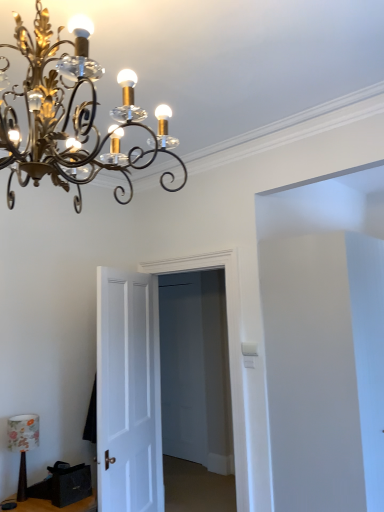
This screenshot has width=384, height=512. Describe the element at coordinates (128, 393) in the screenshot. I see `white matte door at center, positioned as the 1th door in left-to-right order` at that location.

How much space does white wooden door at center, which appears as the 1th door when viewed from the right, occupy vertically?

white wooden door at center, which appears as the 1th door when viewed from the right, is 2.24 meters in height.

The width and height of the screenshot is (384, 512). Describe the element at coordinates (23, 444) in the screenshot. I see `floral fabric lampshade at lower left, the 2th lamp positioned from the top` at that location.

Locate an element on the screen. white matte door at center, positioned as the 1th door in left-to-right order is located at coordinates (128, 393).

Between floral fabric lampshade at lower left, arranged as the second lamp when viewed from the front, and white matte door at center, placed as the second door when sorted from right to left, which one has smaller width?

With smaller width is white matte door at center, placed as the second door when sorted from right to left.

How different are the orientations of floral fabric lampshade at lower left, which ranks as the 1th lamp in bottom-to-top order, and white matte door at center, positioned as the 1th door in left-to-right order, in degrees?

floral fabric lampshade at lower left, which ranks as the 1th lamp in bottom-to-top order, and white matte door at center, positioned as the 1th door in left-to-right order, are facing 26.9 degrees away from each other.

Is floral fabric lampshade at lower left, the 2th lamp in the right-to-left sequence, bigger or smaller than white matte door at center, placed as the second door when sorted from right to left?

Clearly, floral fabric lampshade at lower left, the 2th lamp in the right-to-left sequence, is smaller in size than white matte door at center, placed as the second door when sorted from right to left.

Considering the relative sizes of floral fabric lampshade at lower left, the 2th lamp in the right-to-left sequence, and white matte door at center, positioned as the 1th door in left-to-right order, in the image provided, is floral fabric lampshade at lower left, the 2th lamp in the right-to-left sequence, taller than white matte door at center, positioned as the 1th door in left-to-right order,?

In fact, floral fabric lampshade at lower left, the 2th lamp in the right-to-left sequence, may be shorter than white matte door at center, positioned as the 1th door in left-to-right order.

From the image's perspective, would you say floral fabric lampshade at lower left, the 2th lamp in the right-to-left sequence, is shown under gold metallic chandelier at upper left, which ranks as the 2th lamp in back-to-front order?

Yes, from the image's perspective, floral fabric lampshade at lower left, the 2th lamp in the right-to-left sequence, is beneath gold metallic chandelier at upper left, which ranks as the 2th lamp in back-to-front order.

Is floral fabric lampshade at lower left, acting as the first lamp starting from the back, far away from gold metallic chandelier at upper left, the first lamp viewed from the right?

That's right, there is a large distance between floral fabric lampshade at lower left, acting as the first lamp starting from the back, and gold metallic chandelier at upper left, the first lamp viewed from the right.

From a real-world perspective, which is physically below, floral fabric lampshade at lower left, arranged as the second lamp when viewed from the front, or gold metallic chandelier at upper left, the 2th lamp in the bottom-to-top sequence?

floral fabric lampshade at lower left, arranged as the second lamp when viewed from the front, is physically lower.

Who is bigger, floral fabric lampshade at lower left, which ranks as the 1th lamp in bottom-to-top order, or gold metallic chandelier at upper left, which is the first lamp from front to back?

Bigger between the two is gold metallic chandelier at upper left, which is the first lamp from front to back.

In the scene shown: Is gold metallic chandelier at upper left, which ranks as the 2th lamp in back-to-front order, surrounded by black leather drawer at lower left?

Actually, gold metallic chandelier at upper left, which ranks as the 2th lamp in back-to-front order, is outside black leather drawer at lower left.

Is black leather drawer at lower left placed right next to gold metallic chandelier at upper left, the second lamp when ordered from left to right?

black leather drawer at lower left is not next to gold metallic chandelier at upper left, the second lamp when ordered from left to right, and they're not touching.

Considering the positions of objects black leather drawer at lower left and gold metallic chandelier at upper left, which ranks as the 2th lamp in back-to-front order, in the image provided, who is in front, black leather drawer at lower left or gold metallic chandelier at upper left, which ranks as the 2th lamp in back-to-front order,?

gold metallic chandelier at upper left, which ranks as the 2th lamp in back-to-front order, is closer to the camera.

This screenshot has height=512, width=384. Find the location of `lamp in front of the black leather drawer at lower left`. lamp in front of the black leather drawer at lower left is located at coordinates (70, 115).

Is black fabric speaker at lower left far away from black leather drawer at lower left?

black fabric speaker at lower left is actually quite close to black leather drawer at lower left.

Is black leather drawer at lower left at the back of black fabric speaker at lower left?

No.

From the image's perspective, is black fabric speaker at lower left positioned above or below black leather drawer at lower left?

Clearly, from the image's perspective, black fabric speaker at lower left is below black leather drawer at lower left.

Based on their sizes in the image, would you say white wooden door at center, positioned as the 2th door in left-to-right order, is bigger or smaller than gold metallic chandelier at upper left, which is the first lamp from front to back?

Clearly, white wooden door at center, positioned as the 2th door in left-to-right order, is smaller in size than gold metallic chandelier at upper left, which is the first lamp from front to back.

From the picture: How far apart are white wooden door at center, which appears as the 1th door when viewed from the right, and gold metallic chandelier at upper left, the 2th lamp in the bottom-to-top sequence?

white wooden door at center, which appears as the 1th door when viewed from the right, is 1.72 meters away from gold metallic chandelier at upper left, the 2th lamp in the bottom-to-top sequence.

In the image, is white wooden door at center, which appears as the 1th door when viewed from the right, on the left side or the right side of gold metallic chandelier at upper left, the second lamp when ordered from left to right?

In the image, white wooden door at center, which appears as the 1th door when viewed from the right, appears on the right side of gold metallic chandelier at upper left, the second lamp when ordered from left to right.

Which object is closer to the camera taking this photo, white wooden door at center, positioned as the 2th door in left-to-right order, or gold metallic chandelier at upper left, which ranks as the 2th lamp in back-to-front order?

gold metallic chandelier at upper left, which ranks as the 2th lamp in back-to-front order.

Can you see black leather drawer at lower left touching white matte door at center, positioned as the 1th door in left-to-right order?

black leather drawer at lower left is not next to white matte door at center, positioned as the 1th door in left-to-right order, and they're not touching.

From a real-world perspective, between black leather drawer at lower left and white matte door at center, placed as the second door when sorted from right to left, who is vertically higher?

From a 3D spatial view, white matte door at center, placed as the second door when sorted from right to left, is above.

Does point (52, 467) appear closer or farther from the camera than point (106, 362)?

Point (52, 467) is positioned closer to the camera compared to point (106, 362).

Is black leather drawer at lower left oriented away from white matte door at center, positioned as the 1th door in left-to-right order?

That's not correct — black leather drawer at lower left is not looking away from white matte door at center, positioned as the 1th door in left-to-right order.

From the image's perspective, which object appears higher, black leather drawer at lower left or white wooden door at center, positioned as the 2th door in left-to-right order?

white wooden door at center, positioned as the 2th door in left-to-right order, is shown above in the image.

From the picture: How different are the orientations of black leather drawer at lower left and white wooden door at center, which appears as the 1th door when viewed from the right, in degrees?

89.5 degrees.

Is black leather drawer at lower left oriented towards white wooden door at center, positioned as the 2th door in left-to-right order?

No.

Locate an element on the screen. This screenshot has height=512, width=384. lamp on the left of the white matte door at center, placed as the second door when sorted from right to left is located at coordinates (23, 444).

Where is `lamp lying on the right of floral fabric lampshade at lower left, placed as the first lamp when sorted from left to right`? This screenshot has height=512, width=384. lamp lying on the right of floral fabric lampshade at lower left, placed as the first lamp when sorted from left to right is located at coordinates (70, 115).

From the picture: When comparing their distances from black leather drawer at lower left, does gold metallic chandelier at upper left, which is the first lamp from front to back, or white matte door at center, placed as the second door when sorted from right to left, seem further?

gold metallic chandelier at upper left, which is the first lamp from front to back, is further to black leather drawer at lower left.

Which object lies further to the anchor point white matte door at center, positioned as the 1th door in left-to-right order, black leather drawer at lower left or gold metallic chandelier at upper left, which is the first lamp from front to back?

Based on the image, gold metallic chandelier at upper left, which is the first lamp from front to back, appears to be further to white matte door at center, positioned as the 1th door in left-to-right order.

When comparing their distances from gold metallic chandelier at upper left, which is the first lamp from front to back, does white matte door at center, positioned as the 1th door in left-to-right order, or white wooden door at center, positioned as the 2th door in left-to-right order, seem closer?

Based on the image, white wooden door at center, positioned as the 2th door in left-to-right order, appears to be nearer to gold metallic chandelier at upper left, which is the first lamp from front to back.

Which object lies nearer to the anchor point black fabric speaker at lower left, black leather drawer at lower left or white wooden door at center, positioned as the 2th door in left-to-right order?

black leather drawer at lower left lies closer to black fabric speaker at lower left than the other object.

Estimate the real-world distances between objects in this image. Which object is closer to black fabric speaker at lower left, white matte door at center, positioned as the 1th door in left-to-right order, or white wooden door at center, positioned as the 2th door in left-to-right order?

white matte door at center, positioned as the 1th door in left-to-right order.

Consider the image. Which object lies further to the anchor point white matte door at center, placed as the second door when sorted from right to left, gold metallic chandelier at upper left, the first lamp viewed from the top, or white wooden door at center, positioned as the 2th door in left-to-right order?

gold metallic chandelier at upper left, the first lamp viewed from the top, is further to white matte door at center, placed as the second door when sorted from right to left.

Considering their positions, is black leather drawer at lower left positioned further to gold metallic chandelier at upper left, which ranks as the 2th lamp in back-to-front order, than black fabric speaker at lower left?

black fabric speaker at lower left is further to gold metallic chandelier at upper left, which ranks as the 2th lamp in back-to-front order.

Considering their positions, is gold metallic chandelier at upper left, the 2th lamp in the bottom-to-top sequence, positioned closer to black fabric speaker at lower left than white wooden door at center, positioned as the 2th door in left-to-right order?

The object closer to black fabric speaker at lower left is white wooden door at center, positioned as the 2th door in left-to-right order.

You are a GUI agent. You are given a task and a screenshot of the screen. Output one action in this format:
    pyautogui.click(x=<x>, y=<y>)
    Task: Click on the drawer between gold metallic chandelier at upper left, the first lamp viewed from the right, and white wooden door at center, positioned as the 2th door in left-to-right order, from front to back
    The image size is (384, 512).
    Given the screenshot: What is the action you would take?
    pyautogui.click(x=69, y=483)

Where is `lamp between gold metallic chandelier at upper left, the second lamp when ordered from left to right, and black leather drawer at lower left in the up-down direction`? This screenshot has width=384, height=512. lamp between gold metallic chandelier at upper left, the second lamp when ordered from left to right, and black leather drawer at lower left in the up-down direction is located at coordinates (23, 444).

Locate an element on the screen. The height and width of the screenshot is (512, 384). drawer between floral fabric lampshade at lower left, the 2th lamp in the right-to-left sequence, and black fabric speaker at lower left from top to bottom is located at coordinates (69, 483).

This screenshot has width=384, height=512. I want to click on door located between floral fabric lampshade at lower left, the 2th lamp in the right-to-left sequence, and white wooden door at center, positioned as the 2th door in left-to-right order, in the left-right direction, so click(x=128, y=393).